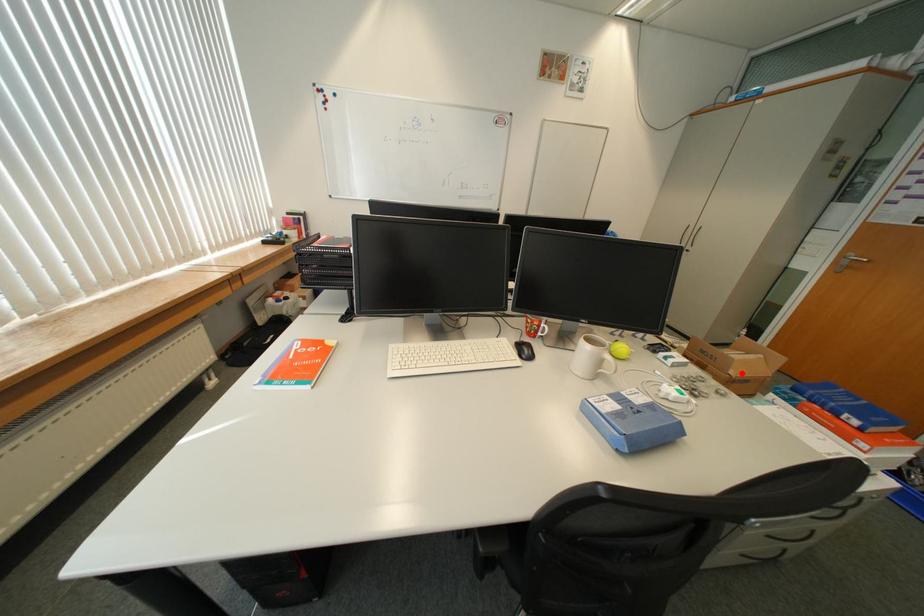
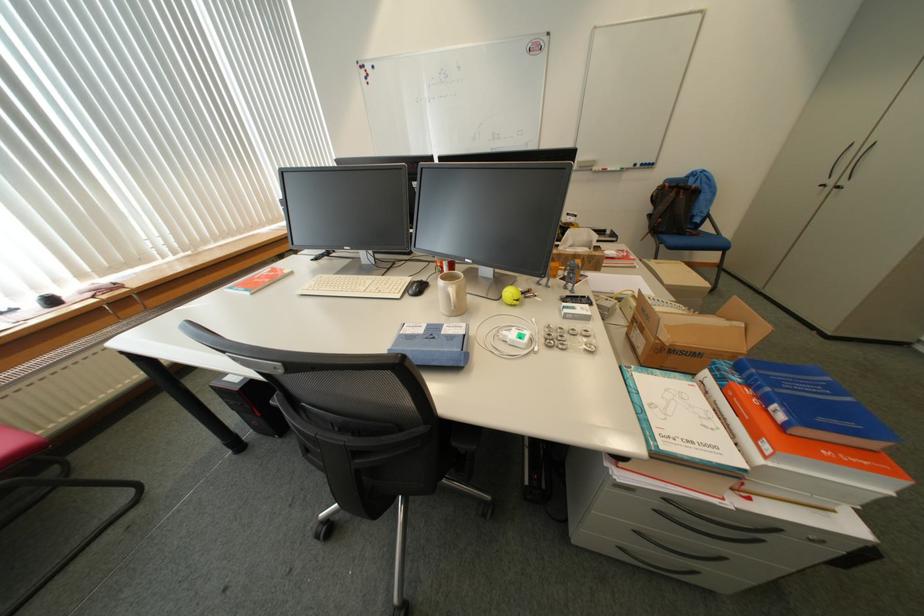
Find the pixel in the second image that matches the highlighted location in the first image.

(675, 339)